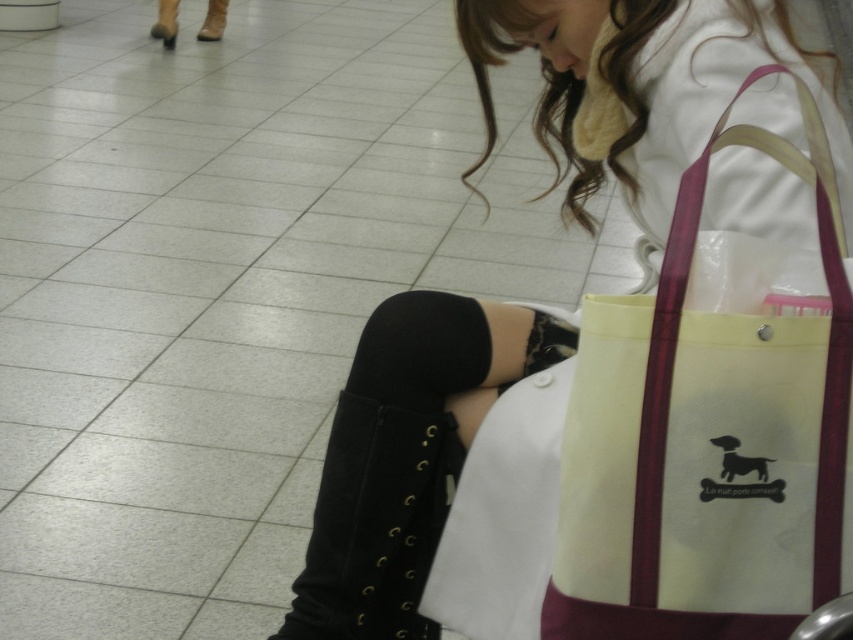
Question: In this image, where is matte black thigh-high boots at lower left located relative to black leather boot at lower center?

Choices:
 (A) below
 (B) above

Answer: (B)

Question: Considering the real-world distances, which object is farthest from the black leather boot at lower center?

Choices:
 (A) matte black thigh-high boots at lower left
 (B) beige canvas tote at right

Answer: (B)

Question: Based on their relative distances, which object is farther from the matte black thigh-high boots at lower left?

Choices:
 (A) black leather boot at lower center
 (B) beige canvas tote at right

Answer: (B)

Question: Which point is farther to the camera?

Choices:
 (A) [x=741, y=228]
 (B) [x=590, y=340]
 (C) [x=363, y=440]

Answer: (C)

Question: Does matte black thigh-high boots at lower left appear on the right side of black leather boot at lower center?

Choices:
 (A) yes
 (B) no

Answer: (A)

Question: Is beige canvas tote at right further to the viewer compared to black leather boot at lower center?

Choices:
 (A) yes
 (B) no

Answer: (B)